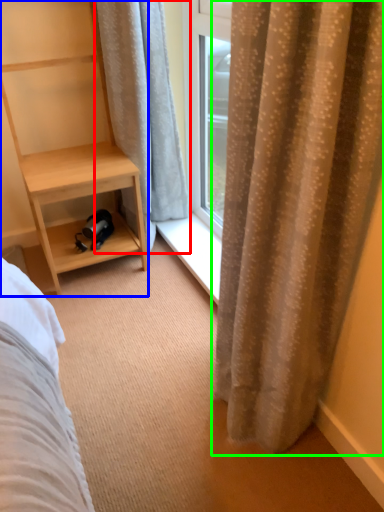
Question: Which is farther away from curtain (highlighted by a red box)? shelf (highlighted by a blue box) or curtain (highlighted by a green box)?

Choices:
 (A) shelf
 (B) curtain

Answer: (B)